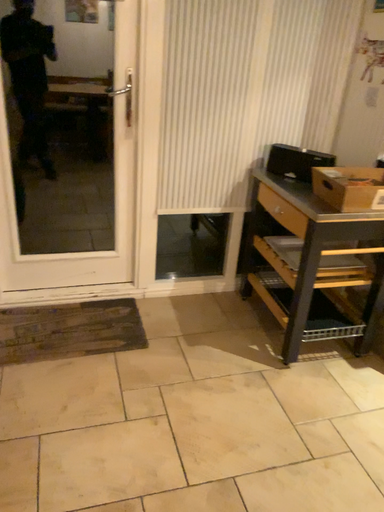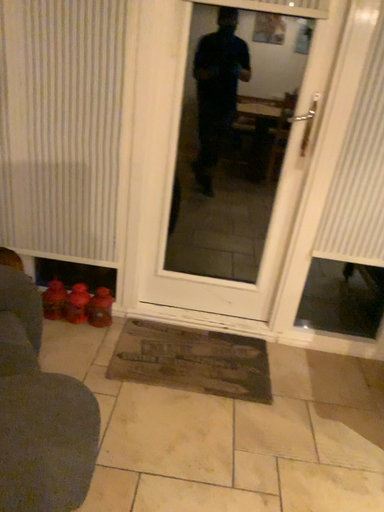
Question: Which way did the camera rotate in the video?

Choices:
 (A) rotated left
 (B) rotated right

Answer: (A)